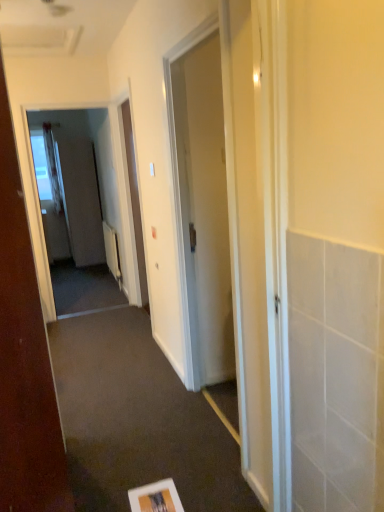
Question: From the image's perspective, is matte white screen door at left, the first screen door when ordered from back to front, above or below white sheer curtain at left?

Choices:
 (A) below
 (B) above

Answer: (A)

Question: Would you say matte white screen door at left, the first screen door when ordered from back to front, is to the left or to the right of white sheer curtain at left in the picture?

Choices:
 (A) right
 (B) left

Answer: (A)

Question: Considering the real-world distances, which object is closest to the matte white screen door at left, the 1th screen door in the left-to-right sequence?

Choices:
 (A) transparent glass screen door at left, which is the 2th screen door from left to right
 (B) white glossy door at left, the 2th door when ordered from right to left
 (C) white glossy door at center, arranged as the 2th door when viewed from the front
 (D) white sheer curtain at left

Answer: (A)

Question: Which of these objects is positioned farthest from the white sheer curtain at left?

Choices:
 (A) white glossy door at left, which appears as the 1th door when viewed from the left
 (B) transparent glass screen door at left, marked as the second screen door in a back-to-front arrangement
 (C) white glossy door at center, arranged as the 2th door when viewed from the front
 (D) matte white screen door at left, the 1th screen door in the left-to-right sequence

Answer: (A)